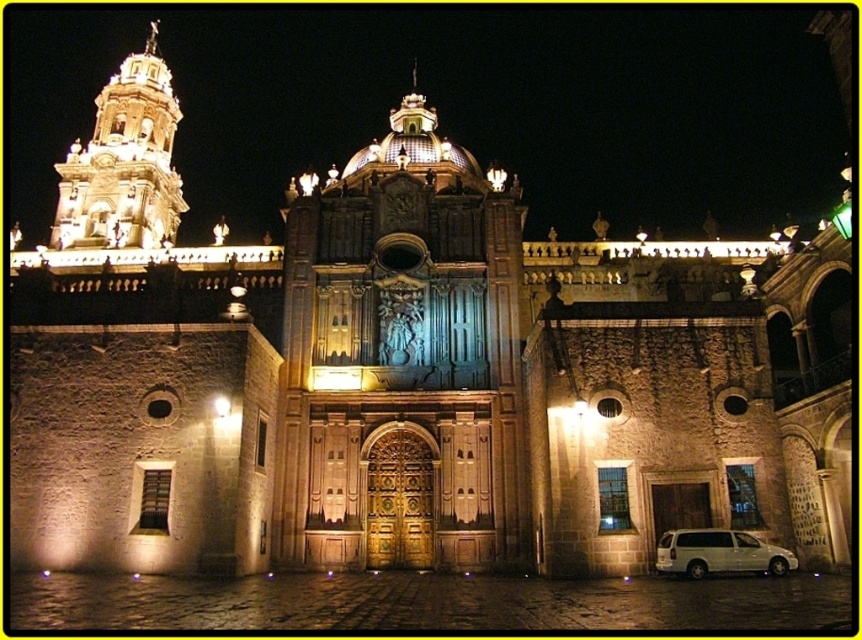
Question: Is golden stone tower at center to the left of golden stone tower at upper left from the viewer's perspective?

Choices:
 (A) no
 (B) yes

Answer: (A)

Question: Can you confirm if golden stone tower at center is smaller than golden stone tower at upper left?

Choices:
 (A) yes
 (B) no

Answer: (A)

Question: Is golden stone tower at center positioned behind white matte van at lower right?

Choices:
 (A) no
 (B) yes

Answer: (B)

Question: Which point is farther to the camera?

Choices:
 (A) (141, 170)
 (B) (429, 243)

Answer: (A)

Question: Which point is farther to the camera?

Choices:
 (A) (482, 360)
 (B) (141, 211)
 (C) (720, 541)

Answer: (B)

Question: Which object appears farthest from the camera in this image?

Choices:
 (A) white matte van at lower right
 (B) golden stone tower at center

Answer: (B)